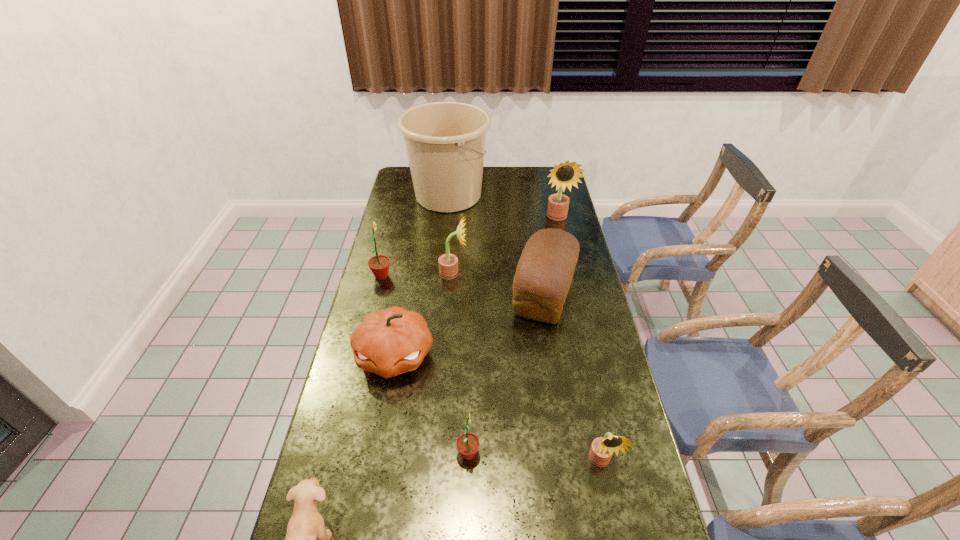
Identify the location of the right green sunflower. This screenshot has height=540, width=960. (467, 444).

This screenshot has width=960, height=540. Identify the location of the smaller green sunflower. (467, 444).

You are a GUI agent. You are given a task and a screenshot of the screen. Output one action in this format:
    pyautogui.click(x=<x>, y=<y>)
    Task: Click on the nearest yellow sunflower
    
    Given the screenshot: What is the action you would take?
    pyautogui.click(x=602, y=448)

Locate an element on the screen. free space located 0.140m on the front of the beige bucket is located at coordinates (444, 239).

Locate an element on the screen. Image resolution: width=960 pixels, height=540 pixels. vacant space located on the face of the tallest sunflower is located at coordinates (563, 238).

At what (x,y) coordinates should I click in order to perform the action: click on free space located on the face of the second smallest yellow sunflower. Please return your answer as a coordinate pair (x, y). Looking at the image, I should click on (527, 273).

Locate an element on the screen. This screenshot has height=540, width=960. vacant region located on the face of the leftmost sunflower is located at coordinates (442, 276).

Find the location of a particular element. This screenshot has width=960, height=540. free region located on the right of the bread is located at coordinates (594, 293).

Locate an element on the screen. free space located on the front face of the pumpkin is located at coordinates (382, 425).

Where is `free spot located on the face of the smaller green sunflower`? The height and width of the screenshot is (540, 960). free spot located on the face of the smaller green sunflower is located at coordinates (598, 454).